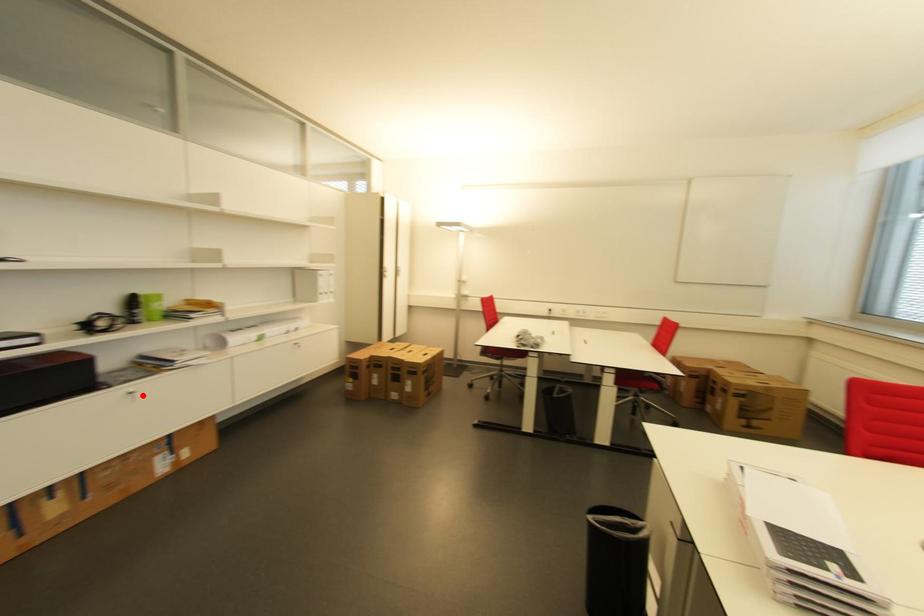
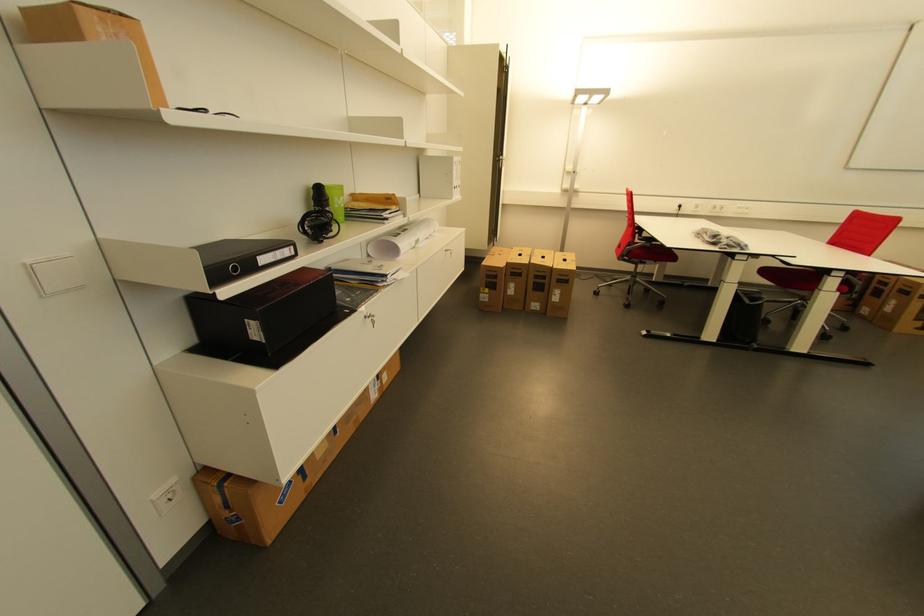
Locate, in the second image, the point that corresponds to the highlighted location in the first image.

(380, 320)